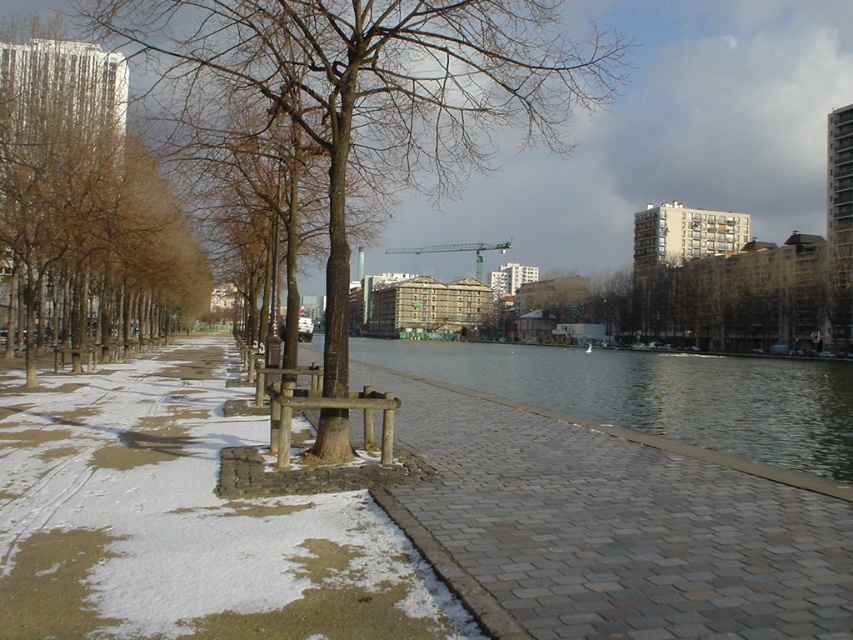
Question: Which of the following is the farthest from the observer?

Choices:
 (A) brown wood tree at center
 (B) wooden bench at center
 (C) clear water at center

Answer: (C)

Question: From the image, what is the correct spatial relationship of clear water at center in relation to green metallic crane at center?

Choices:
 (A) below
 (B) above

Answer: (A)

Question: Which of the following is the closest to the observer?

Choices:
 (A) brown textured tree at center
 (B) brown smooth tree at left
 (C) brown wood tree at center
 (D) wooden bench at center

Answer: (D)

Question: Does brown wood tree at center appear under brown smooth tree at left?

Choices:
 (A) no
 (B) yes

Answer: (A)

Question: Considering the relative positions of brown textured tree at center and wooden park bench at center in the image provided, where is brown textured tree at center located with respect to wooden park bench at center?

Choices:
 (A) left
 (B) right

Answer: (B)

Question: Which point is closer to the camera?

Choices:
 (A) brown smooth tree at left
 (B) wooden bench at center

Answer: (B)